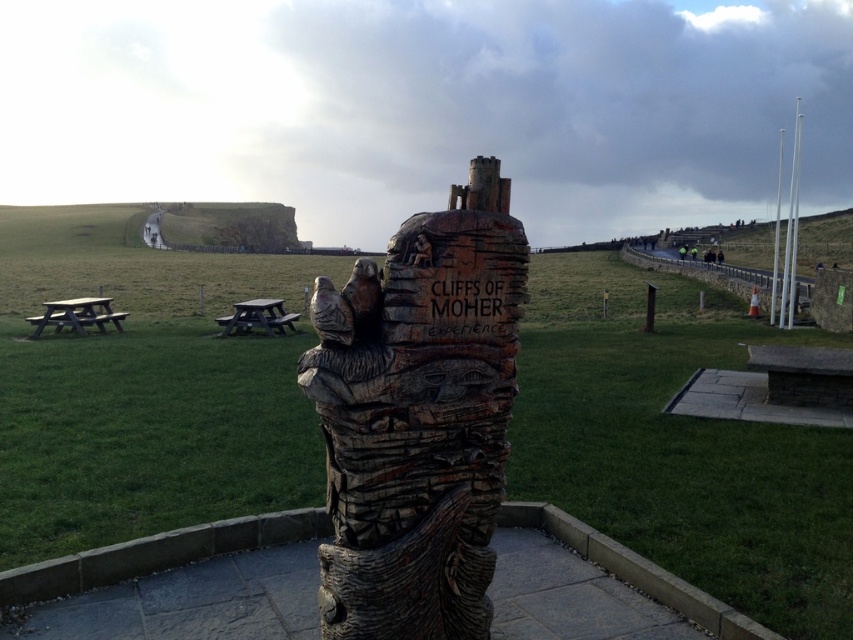
Question: Does wooden picnic table at left have a greater width compared to wooden picnic table at center-left?

Choices:
 (A) yes
 (B) no

Answer: (A)

Question: Is wooden totem pole at center positioned at the back of wooden carving at center?

Choices:
 (A) yes
 (B) no

Answer: (A)

Question: Among these points, which one is nearest to the camera?

Choices:
 (A) pos(250,323)
 (B) pos(105,305)
 (C) pos(776,285)

Answer: (A)

Question: Among these objects, which one is nearest to the camera?

Choices:
 (A) wooden totem pole at right
 (B) wooden carving at center
 (C) wooden totem pole at center
 (D) wooden picnic table at center-left

Answer: (B)

Question: Does wooden picnic table at left have a lesser width compared to white wood totem pole at right?

Choices:
 (A) no
 (B) yes

Answer: (B)

Question: Which point is farther from the camera taking this photo?

Choices:
 (A) (788, 310)
 (B) (773, 262)

Answer: (B)